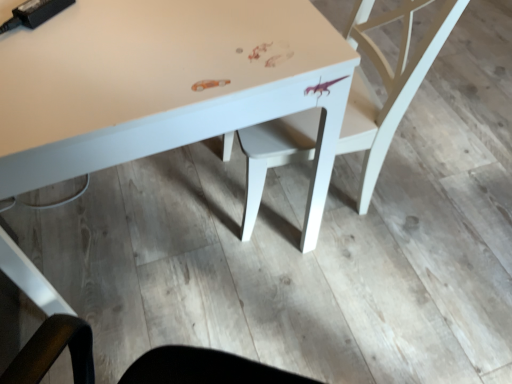
Find the location of a particular element. The height and width of the screenshot is (384, 512). free location in front of white matte chair at center is located at coordinates (331, 299).